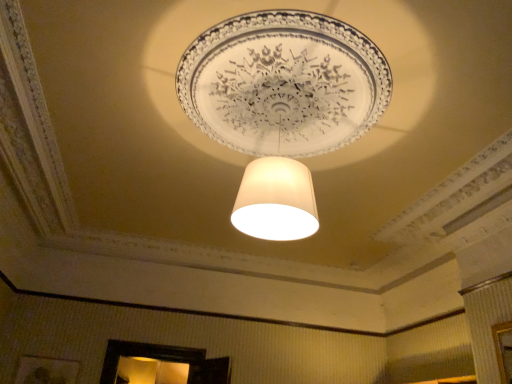
What do you see at coordinates (276, 200) in the screenshot? I see `white fabric lampshade at center` at bounding box center [276, 200].

What is the approximate width of white fabric lampshade at center?

60.15 centimeters.

Where is `white fabric lampshade at center`? The image size is (512, 384). white fabric lampshade at center is located at coordinates (276, 200).

Find the location of a particular element. Image resolution: width=512 pixels, height=384 pixels. white fabric lampshade at center is located at coordinates (276, 200).